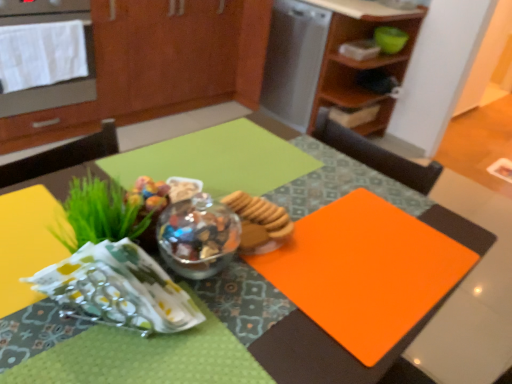
Question: From the image's perspective, is orange matte placemat at center located beneath wooden cabinet at upper right, the first cabinetry in the right-to-left sequence?

Choices:
 (A) no
 (B) yes

Answer: (B)

Question: Is orange matte placemat at center wider than wooden cabinet at upper right, placed as the 2th cabinetry when sorted from left to right?

Choices:
 (A) yes
 (B) no

Answer: (B)

Question: Is wooden cabinet at upper right, the first cabinetry in the right-to-left sequence, at the back of orange matte placemat at center?

Choices:
 (A) yes
 (B) no

Answer: (B)

Question: Considering the relative positions of orange matte placemat at center and wooden cabinet at upper right, placed as the 2th cabinetry when sorted from left to right, in the image provided, is orange matte placemat at center to the right of wooden cabinet at upper right, placed as the 2th cabinetry when sorted from left to right, from the viewer's perspective?

Choices:
 (A) no
 (B) yes

Answer: (A)

Question: Can you see orange matte placemat at center touching wooden cabinet at upper right, the first cabinetry in the right-to-left sequence?

Choices:
 (A) no
 (B) yes

Answer: (A)

Question: Considering the relative positions of green leafy grass at left and brushed metal oven at upper left in the image provided, is green leafy grass at left to the left or to the right of brushed metal oven at upper left?

Choices:
 (A) right
 (B) left

Answer: (A)

Question: Do you think green leafy grass at left is within brushed metal oven at upper left, or outside of it?

Choices:
 (A) outside
 (B) inside

Answer: (A)

Question: Is green leafy grass at left wider or thinner than brushed metal oven at upper left?

Choices:
 (A) thin
 (B) wide

Answer: (A)

Question: In terms of height, does green leafy grass at left look taller or shorter compared to brushed metal oven at upper left?

Choices:
 (A) tall
 (B) short

Answer: (B)

Question: From a real-world perspective, is teal bowl at upper right above or below satin silver dishwasher at upper center?

Choices:
 (A) below
 (B) above

Answer: (B)

Question: In terms of width, does teal bowl at upper right look wider or thinner when compared to satin silver dishwasher at upper center?

Choices:
 (A) wide
 (B) thin

Answer: (B)

Question: Is teal bowl at upper right taller or shorter than satin silver dishwasher at upper center?

Choices:
 (A) short
 (B) tall

Answer: (A)

Question: From the image's perspective, is teal bowl at upper right positioned above or below satin silver dishwasher at upper center?

Choices:
 (A) above
 (B) below

Answer: (A)

Question: Is point (380, 36) closer or farther from the camera than point (371, 28)?

Choices:
 (A) closer
 (B) farther

Answer: (A)

Question: From a real-world perspective, is teal bowl at upper right positioned above or below wooden cabinet at upper right, the first cabinetry in the right-to-left sequence?

Choices:
 (A) below
 (B) above

Answer: (B)